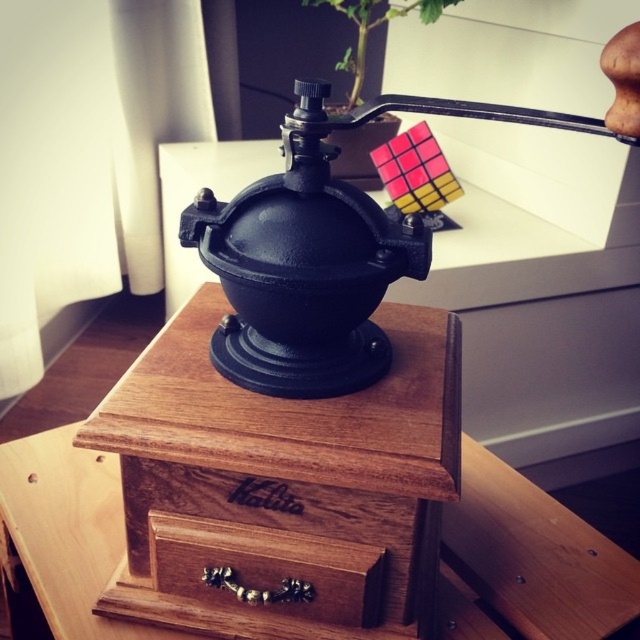
Does brown wood drawer at center have a greater height compared to green leafy plant at upper center?

No.

Between brown wood drawer at center and green leafy plant at upper center, which one has more height?

With more height is green leafy plant at upper center.

Which is behind, point (220, 552) or point (358, 65)?

The point (358, 65) is behind.

You are a GUI agent. You are given a task and a screenshot of the screen. Output one action in this format:
    pyautogui.click(x=<x>, y=<y>)
    Task: Click on the brown wood drawer at center
    Image resolution: width=640 pixels, height=640 pixels.
    Given the screenshot: What is the action you would take?
    pyautogui.click(x=268, y=570)

How far apart are black cast iron coffee grinder at center and wooden table at center?

They are 41.24 centimeters apart.

At what (x,y) coordinates should I click in order to perform the action: click on black cast iron coffee grinder at center. Please return your answer as a coordinate pair (x, y). The height and width of the screenshot is (640, 640). Looking at the image, I should click on (305, 262).

This screenshot has height=640, width=640. I want to click on black cast iron coffee grinder at center, so click(305, 262).

Consider the image. Does black cast iron coffee grinder at center appear over brown wood drawer at center?

Yes.

Does black cast iron coffee grinder at center have a greater width compared to brown wood drawer at center?

Yes, black cast iron coffee grinder at center is wider than brown wood drawer at center.

Who is more distant from viewer, (378,332) or (316,595)?

Point (378,332)

I want to click on black cast iron coffee grinder at center, so pos(305,262).